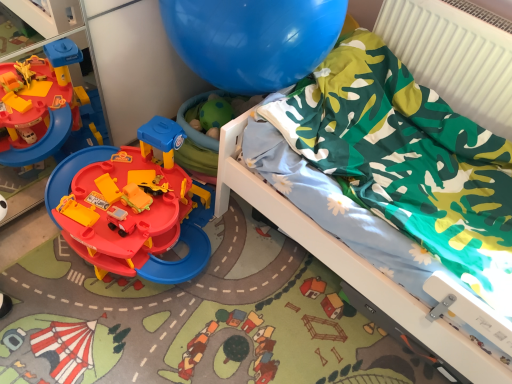
Question: From the image's perspective, is green camouflage fabric at upper right located above or below green fabric at upper right?

Choices:
 (A) above
 (B) below

Answer: (B)

Question: Considering the positions of green camouflage fabric at upper right and green fabric at upper right in the image, is green camouflage fabric at upper right wider or thinner than green fabric at upper right?

Choices:
 (A) thin
 (B) wide

Answer: (B)

Question: Visually, is green camouflage fabric at upper right positioned to the left or to the right of green fabric at upper right?

Choices:
 (A) right
 (B) left

Answer: (B)

Question: Considering the positions of green fabric at upper right and green camouflage fabric at upper right in the image, is green fabric at upper right wider or thinner than green camouflage fabric at upper right?

Choices:
 (A) thin
 (B) wide

Answer: (A)

Question: Is green fabric at upper right in front of or behind green camouflage fabric at upper right in the image?

Choices:
 (A) front
 (B) behind

Answer: (B)

Question: Which is correct: green fabric at upper right is inside green camouflage fabric at upper right, or outside of it?

Choices:
 (A) outside
 (B) inside

Answer: (A)

Question: Based on their positions, is green fabric at upper right located to the left or right of green camouflage fabric at upper right?

Choices:
 (A) left
 (B) right

Answer: (B)